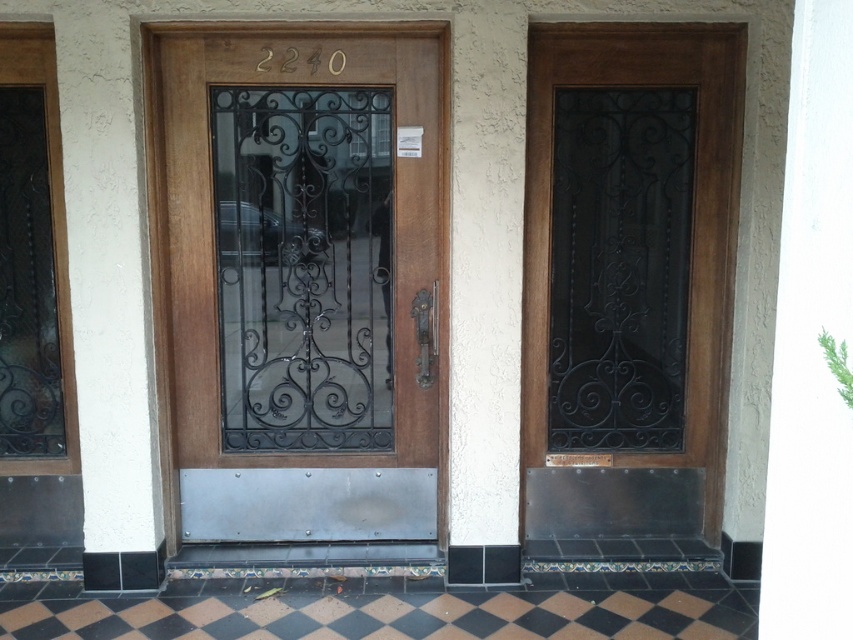
You are a delivery person carrying a package that requires a clearance of 2.5 inches between the two doors. Can you fit your package through the space between the matte wood door at center and the black wrought iron glass door at center?

The distance between the matte wood door at center and the black wrought iron glass door at center is 2.52 inches, which is just enough to allow the package with a required clearance of 2.5 inches to pass through.

You are a delivery person trying to deliver a package to room 2240. The package is too large to fit through a standard door. You see the matte wood door at center and the black wrought iron glass door at center. Which door should you choose to ensure the package fits through?

The matte wood door at center is bigger than the black wrought iron glass door at center, so you should choose the matte wood door at center to ensure the package fits through.